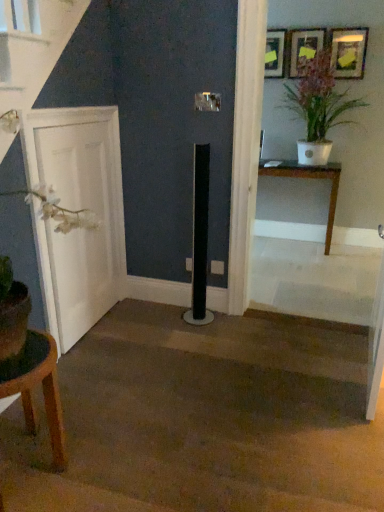
This screenshot has height=512, width=384. Describe the element at coordinates (44, 400) in the screenshot. I see `brown wooden table at lower left, the second table positioned from the back` at that location.

Measure the distance between brown wooden table at lower left, the second table positioned from the top, and camera.

brown wooden table at lower left, the second table positioned from the top, and camera are 1.37 meters apart from each other.

Find the location of a particular element. matte black picture frame at upper center, which appears as the third picture frame when viewed from the right is located at coordinates (275, 53).

What do you see at coordinates (275, 53) in the screenshot? Image resolution: width=384 pixels, height=512 pixels. I see `matte black picture frame at upper center, the first picture frame when ordered from left to right` at bounding box center [275, 53].

At what (x,y) coordinates should I click in order to perform the action: click on wooden picture frame at upper center, acting as the 2th picture frame starting from the left. Please return your answer as a coordinate pair (x, y). The height and width of the screenshot is (512, 384). Looking at the image, I should click on (x=303, y=49).

What is the approximate width of wooden table at right, the first table positioned from the right?

wooden table at right, the first table positioned from the right, is 37.57 centimeters wide.

Measure the distance between point (320, 95) and camera.

3.55 meters.

Locate an element on the screen. brown wooden table at lower left, acting as the 1th table starting from the left is located at coordinates (44, 400).

Is brown wooden table at lower left, the second table positioned from the top, to the right of brown carpet at center from the viewer's perspective?

No.

Is brown wooden table at lower left, the 1th table viewed from the front, aimed at brown carpet at center?

No, brown wooden table at lower left, the 1th table viewed from the front, is not aimed at brown carpet at center.

Is brown wooden table at lower left, the second table positioned from the back, spatially inside brown carpet at center, or outside of it?

brown wooden table at lower left, the second table positioned from the back, is outside brown carpet at center.

Can you confirm if brown wooden table at lower left, the second table from the right, is smaller than brown carpet at center?

Yes.

Considering their positions, is matte black picture frame at upper right, the third picture frame positioned from the left, located in front of or behind brown wooden table at lower left, acting as the 1th table starting from the left?

matte black picture frame at upper right, the third picture frame positioned from the left, is behind brown wooden table at lower left, acting as the 1th table starting from the left.

From a real-world perspective, between matte black picture frame at upper right, the third picture frame positioned from the left, and brown wooden table at lower left, the second table positioned from the back, who is vertically lower?

brown wooden table at lower left, the second table positioned from the back.

From the image's perspective, relative to brown wooden table at lower left, acting as the 1th table starting from the left, is matte black picture frame at upper right, which is the 1th picture frame in right-to-left order, above or below?

matte black picture frame at upper right, which is the 1th picture frame in right-to-left order, is above brown wooden table at lower left, acting as the 1th table starting from the left.

Measure the distance from matte black picture frame at upper center, the first picture frame when ordered from left to right, to brown carpet at center.

A distance of 2.85 meters exists between matte black picture frame at upper center, the first picture frame when ordered from left to right, and brown carpet at center.

Are matte black picture frame at upper center, the first picture frame when ordered from left to right, and brown carpet at center far apart?

That's right, there is a large distance between matte black picture frame at upper center, the first picture frame when ordered from left to right, and brown carpet at center.

Does matte black picture frame at upper center, the first picture frame when ordered from left to right, turn towards brown carpet at center?

No, matte black picture frame at upper center, the first picture frame when ordered from left to right, is not aimed at brown carpet at center.

The image size is (384, 512). I want to click on stairwell in front of the matte black picture frame at upper center, which appears as the third picture frame when viewed from the right, so click(x=207, y=418).

Does matte black picture frame at upper right, which is the 1th picture frame in right-to-left order, lie in front of wooden table at right, positioned as the 2th table in bottom-to-top order?

Yes, matte black picture frame at upper right, which is the 1th picture frame in right-to-left order, is in front of wooden table at right, positioned as the 2th table in bottom-to-top order.

Find the location of a particular element. The image size is (384, 512). table behind the matte black picture frame at upper right, the third picture frame positioned from the left is located at coordinates (310, 178).

From the picture: Considering the sizes of objects wooden table at right, placed as the first table when sorted from top to bottom, and white glossy pot at upper right in the image provided, who is smaller, wooden table at right, placed as the first table when sorted from top to bottom, or white glossy pot at upper right?

With smaller size is wooden table at right, placed as the first table when sorted from top to bottom.

Considering their positions, is wooden table at right, placed as the first table when sorted from top to bottom, located in front of or behind white glossy pot at upper right?

wooden table at right, placed as the first table when sorted from top to bottom, is positioned farther from the viewer than white glossy pot at upper right.

Does point (276, 166) lie in front of point (293, 97)?

That is True.

Between white matte door at left and wooden table at right, placed as the second table when sorted from front to back, which one is positioned in front?

white matte door at left.

Considering the sizes of white matte door at left and wooden table at right, placed as the first table when sorted from top to bottom, in the image, is white matte door at left taller or shorter than wooden table at right, placed as the first table when sorted from top to bottom,?

Clearly, white matte door at left is taller compared to wooden table at right, placed as the first table when sorted from top to bottom.

Who is smaller, white matte door at left or wooden table at right, the second table positioned from the left?

white matte door at left.

Between white matte door at left and wooden table at right, placed as the 1th table when sorted from back to front, which one appears on the left side from the viewer's perspective?

From the viewer's perspective, white matte door at left appears more on the left side.

Could you tell me if wooden table at right, the first table positioned from the right, is facing brown wooden table at lower left, the second table positioned from the back?

Yes, wooden table at right, the first table positioned from the right, is facing brown wooden table at lower left, the second table positioned from the back.

From a real-world perspective, is wooden table at right, placed as the 1th table when sorted from back to front, above or below brown wooden table at lower left, the second table positioned from the back?

In terms of real-world spatial position, wooden table at right, placed as the 1th table when sorted from back to front, is above brown wooden table at lower left, the second table positioned from the back.

How different are the orientations of wooden table at right, positioned as the 2th table in bottom-to-top order, and brown wooden table at lower left, the second table positioned from the back, in degrees?

There is a 89.2-degree angle between the facing directions of wooden table at right, positioned as the 2th table in bottom-to-top order, and brown wooden table at lower left, the second table positioned from the back.

What are the coordinates of `table that is the 1st one when counting upward from the brown carpet at center (from the image's perspective)` in the screenshot? It's located at (44, 400).

Where is `the 2nd table counting from the left of the matte black picture frame at upper right, which is the 1th picture frame in right-to-left order`? This screenshot has width=384, height=512. the 2nd table counting from the left of the matte black picture frame at upper right, which is the 1th picture frame in right-to-left order is located at coordinates (44, 400).

Looking at the image, which one is located further to brown wooden table at lower left, the second table positioned from the back, white glossy pot at upper right or wooden table at right, placed as the second table when sorted from front to back?

white glossy pot at upper right is further to brown wooden table at lower left, the second table positioned from the back.

From the image, which object appears to be farther from wooden table at right, the second table positioned from the left, brown wooden table at lower left, the second table from the right, or wooden picture frame at upper center, which ranks as the 2th picture frame in right-to-left order?

brown wooden table at lower left, the second table from the right, lies further to wooden table at right, the second table positioned from the left, than the other object.

Estimate the real-world distances between objects in this image. Which object is further from matte black picture frame at upper right, which is the 1th picture frame in right-to-left order, wooden table at right, placed as the first table when sorted from top to bottom, or brown carpet at center?

Based on the image, brown carpet at center appears to be further to matte black picture frame at upper right, which is the 1th picture frame in right-to-left order.

Based on their spatial positions, is white matte door at left or white glossy pot at upper right closer to brown carpet at center?

white matte door at left.

Estimate the real-world distances between objects in this image. Which object is closer to wooden picture frame at upper center, which ranks as the 2th picture frame in right-to-left order, matte black picture frame at upper right, the third picture frame positioned from the left, or brown wooden table at lower left, the 1th table viewed from the front?

Among the two, matte black picture frame at upper right, the third picture frame positioned from the left, is located nearer to wooden picture frame at upper center, which ranks as the 2th picture frame in right-to-left order.

Based on their spatial positions, is matte black picture frame at upper right, which is the 1th picture frame in right-to-left order, or brown carpet at center further from wooden picture frame at upper center, which ranks as the 2th picture frame in right-to-left order?

Based on the image, brown carpet at center appears to be further to wooden picture frame at upper center, which ranks as the 2th picture frame in right-to-left order.

Considering their positions, is white matte door at left positioned further to white glossy pot at upper right than brown carpet at center?

Among the two, brown carpet at center is located further to white glossy pot at upper right.

Looking at the image, which one is located further to wooden picture frame at upper center, acting as the 2th picture frame starting from the left, white glossy pot at upper right or matte black picture frame at upper right, the third picture frame positioned from the left?

Based on the image, white glossy pot at upper right appears to be further to wooden picture frame at upper center, acting as the 2th picture frame starting from the left.

This screenshot has height=512, width=384. Identify the location of door between brown carpet at center and white glossy pot at upper right from front to back. (79, 208).

Find the location of a particular element. This screenshot has height=512, width=384. table between brown wooden table at lower left, the second table from the right, and matte black picture frame at upper center, which appears as the third picture frame when viewed from the right, from front to back is located at coordinates (310, 178).

You are a GUI agent. You are given a task and a screenshot of the screen. Output one action in this format:
    pyautogui.click(x=<x>, y=<y>)
    Task: Click on the houseplant between white matte door at left and matte black picture frame at upper center, the first picture frame when ordered from left to right, along the z-axis
    The width and height of the screenshot is (384, 512).
    Given the screenshot: What is the action you would take?
    pyautogui.click(x=317, y=106)

At what (x,y) coordinates should I click in order to perform the action: click on picture frame that lies between wooden picture frame at upper center, acting as the 2th picture frame starting from the left, and wooden table at right, the second table positioned from the left, from top to bottom. Please return your answer as a coordinate pair (x, y). The width and height of the screenshot is (384, 512). Looking at the image, I should click on pyautogui.click(x=348, y=52).